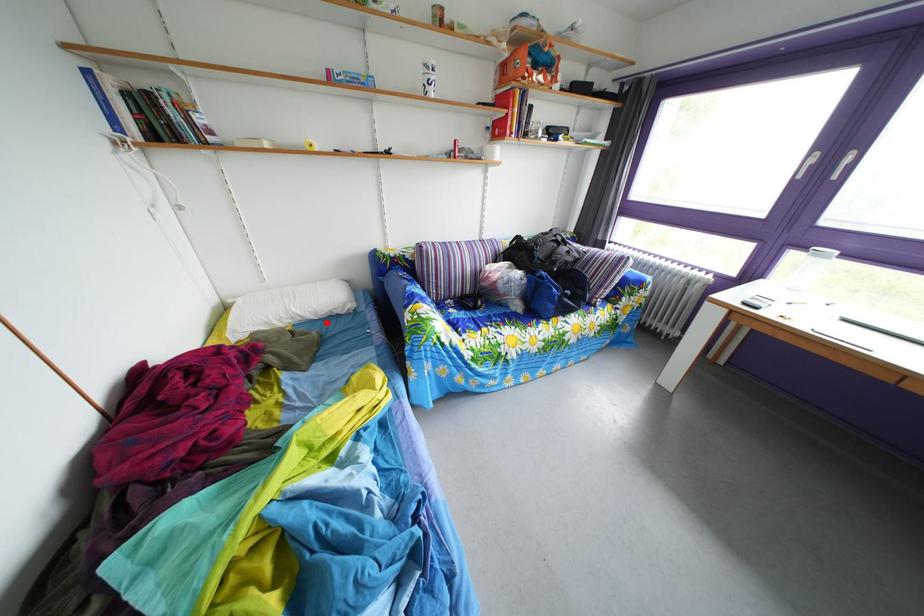
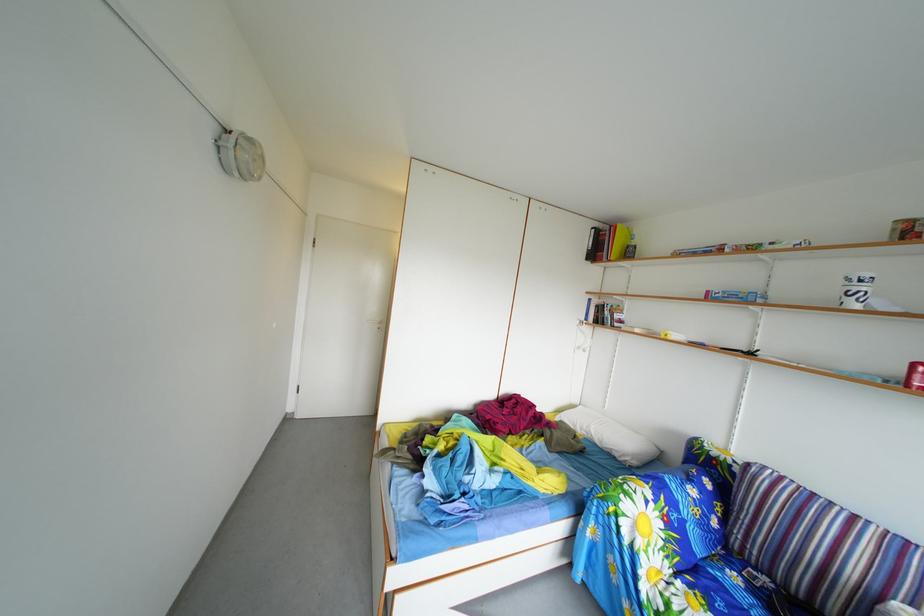
Question: I am providing you with two images of the same scene from different viewpoints. Image1 has a red point marked. In image2, the corresponding 3D location appears at what relative position? Reply with the corresponding letter.

Choices:
 (A) Closer
 (B) Farther

Answer: (B)